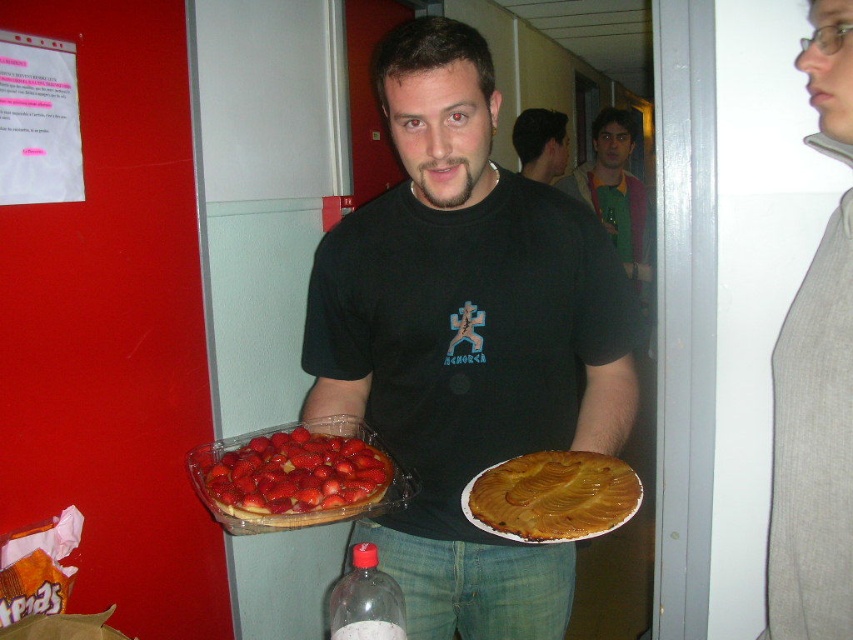
You are a delivery robot in a break room. You need to deliver a package to the green fabric shirt at upper center. There is a glossy plastic strawberry at center in your path. Can you navigate around it?

The glossy plastic strawberry at center and green fabric shirt at upper center are 8.41 feet apart from each other, so yes, the robot can navigate around the glossy plastic strawberry at center to reach the green fabric shirt at upper center since there is enough space between them.

You are standing in the same room as the man holding the desserts. If you want to take a photo of the point at coordinate point [305,474], which is 38.76 inches away, would you need to adjust your camera focus to capture it clearly?

The point at coordinate point [305,474] is 38.76 inches away from the camera. Since this distance is within a typical camera focus range, you should be able to capture it clearly without needing to adjust the focus.

You are a fashion designer observing the man in the image. You need to determine which item is bigger between the green fabric shirt at upper center and the translucent plastic bottle at lower center. Which one is larger?

The green fabric shirt at upper center is larger in size than the translucent plastic bottle at lower center.